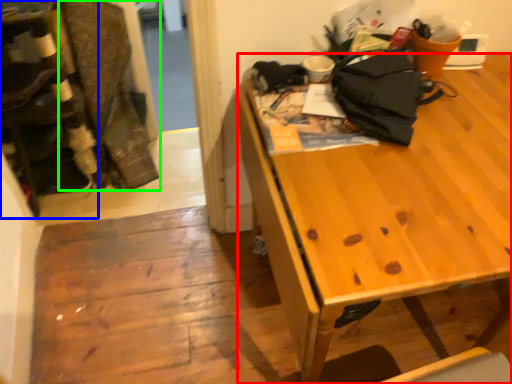
Question: Considering the real-world distances, which object is farthest from desk (highlighted by a red box)? leftover (highlighted by a blue box) or laundry (highlighted by a green box)?

Choices:
 (A) leftover
 (B) laundry

Answer: (B)